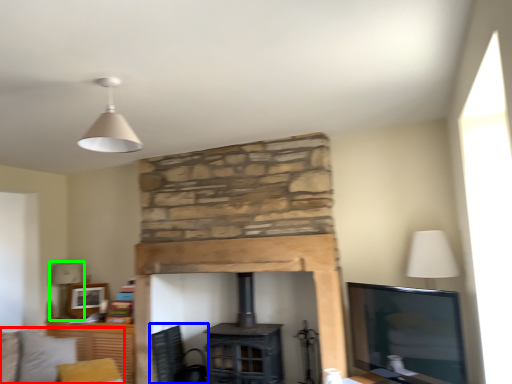
Question: Estimate the real-world distances between objects in this image. Which object is farther from couch (highlighted by a red box), swivel chair (highlighted by a blue box) or table lamp (highlighted by a green box)?

Choices:
 (A) swivel chair
 (B) table lamp

Answer: (A)